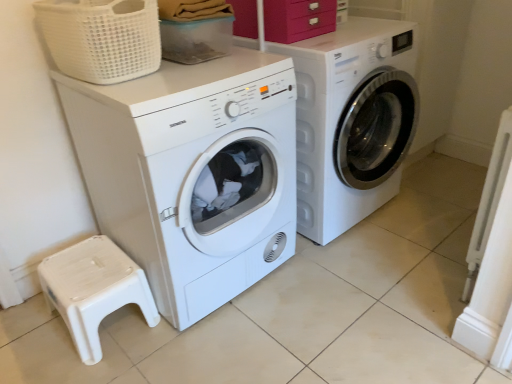
This screenshot has height=384, width=512. I want to click on free space to the right of white woven basket at upper left, so click(x=207, y=76).